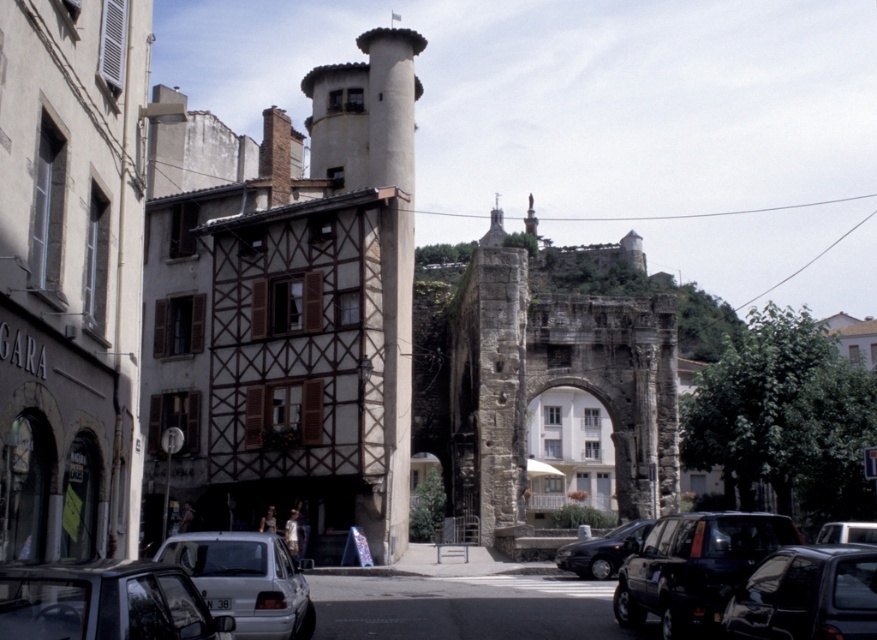
Question: Does shiny black suv at center come in front of black glossy car at center?

Choices:
 (A) yes
 (B) no

Answer: (A)

Question: Which of the following is the closest to the observer?

Choices:
 (A) smooth stone tower at center
 (B) black glossy car at center

Answer: (B)

Question: Where is metallic gray car at lower right located in relation to black glossy car at center in the image?

Choices:
 (A) below
 (B) above

Answer: (B)

Question: Which of the following is the farthest from the observer?

Choices:
 (A) (833, 525)
 (B) (850, 596)

Answer: (A)

Question: Is shiny black suv at center smaller than metallic silver car at center?

Choices:
 (A) no
 (B) yes

Answer: (A)

Question: Estimate the real-world distances between objects in this image. Which object is closer to the black glossy car at center?

Choices:
 (A) metallic silver car at center
 (B) white matte car at lower left
 (C) shiny black suv at center
 (D) silver metallic car at lower left

Answer: (C)